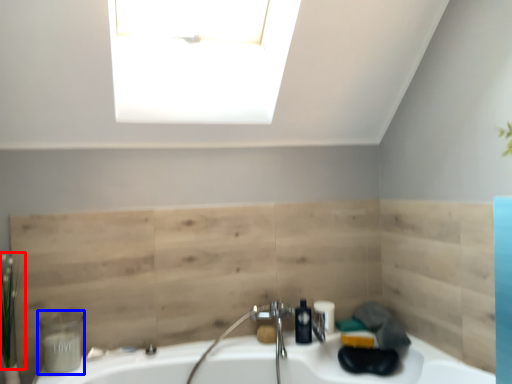
Question: Which object is further to the camera taking this photo, plant (highlighted by a red box) or toiletry (highlighted by a blue box)?

Choices:
 (A) plant
 (B) toiletry

Answer: (B)